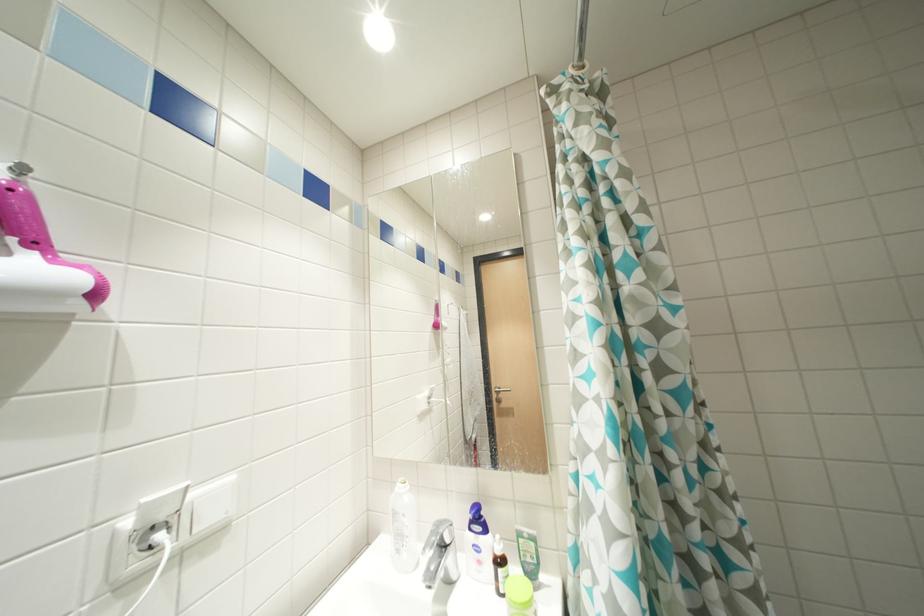
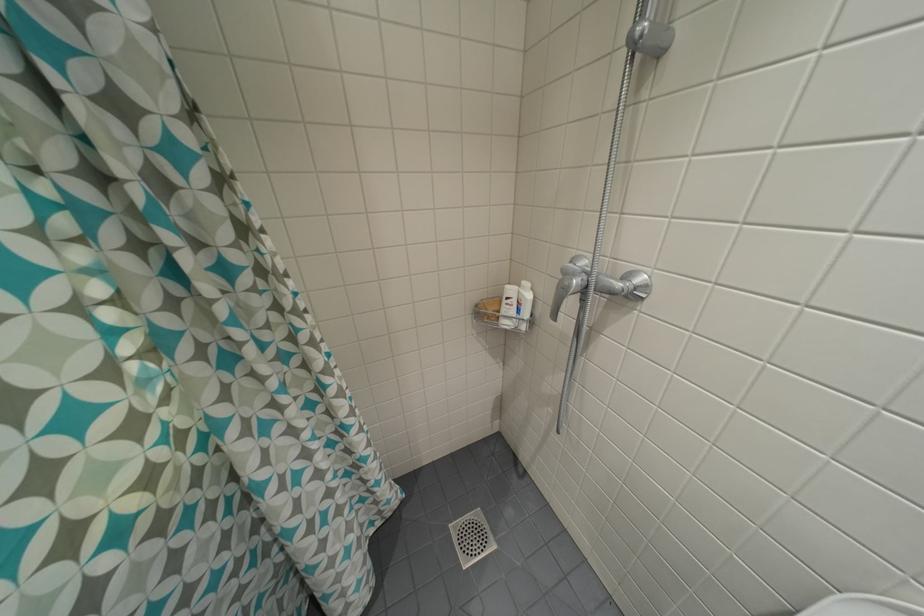
Based on the continuous images, in which direction is the camera rotating?

The camera rotated toward right-down.